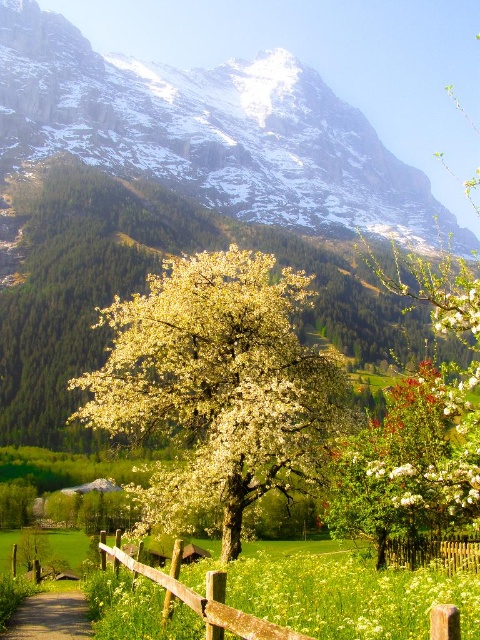
Consider the image. Is brown wooden fence at lower center to the right of brown wooden fence at lower right from the viewer's perspective?

In fact, brown wooden fence at lower center is to the left of brown wooden fence at lower right.

Measure the distance between brown wooden fence at lower center and camera.

brown wooden fence at lower center is 59.78 meters away from camera.

Identify the location of brown wooden fence at lower center. This screenshot has width=480, height=640. (297, 602).

Who is more forward, (260, 180) or (127, 600)?

Point (127, 600) is in front.

Is white textured tree at center smaller than brown wooden fence at lower center?

No, white textured tree at center is not smaller than brown wooden fence at lower center.

The height and width of the screenshot is (640, 480). In order to click on white textured tree at center in this screenshot , I will do `click(176, 198)`.

Based on the photo, can you confirm if brown wooden fence at lower center is positioned to the left of brown dirt path at lower left?

Incorrect, brown wooden fence at lower center is not on the left side of brown dirt path at lower left.

The width and height of the screenshot is (480, 640). What are the coordinates of `brown wooden fence at lower center` in the screenshot? It's located at (297, 602).

Does point (320, 556) come closer to viewer compared to point (76, 608)?

No, it is not.

The image size is (480, 640). What are the coordinates of `brown wooden fence at lower center` in the screenshot? It's located at (297, 602).